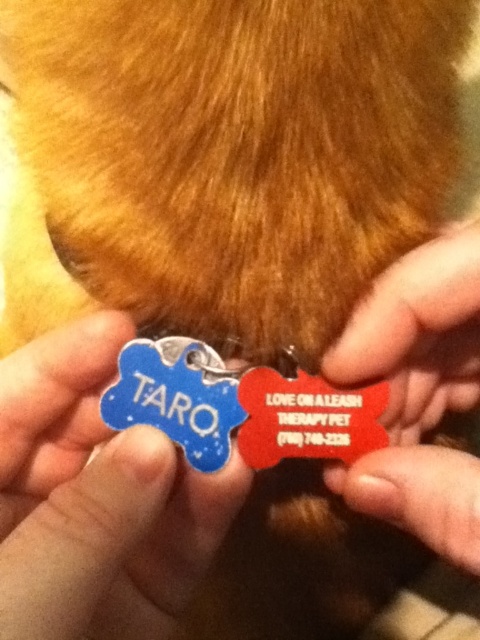
Question: Which point is farther to the camera?

Choices:
 (A) blue enamel bone at center
 (B) matte plastic pet tag at center

Answer: (B)

Question: Can you confirm if blue enamel bone at center is positioned below matte plastic pet tag at center?

Choices:
 (A) yes
 (B) no

Answer: (A)

Question: Is blue enamel bone at center wider than matte plastic pet tag at center?

Choices:
 (A) yes
 (B) no

Answer: (A)

Question: In this image, where is blue enamel bone at center located relative to matte plastic pet tag at center?

Choices:
 (A) above
 (B) below

Answer: (B)

Question: Which point is closer to the camera?

Choices:
 (A) matte plastic pet tag at center
 (B) blue enamel bone at center

Answer: (B)